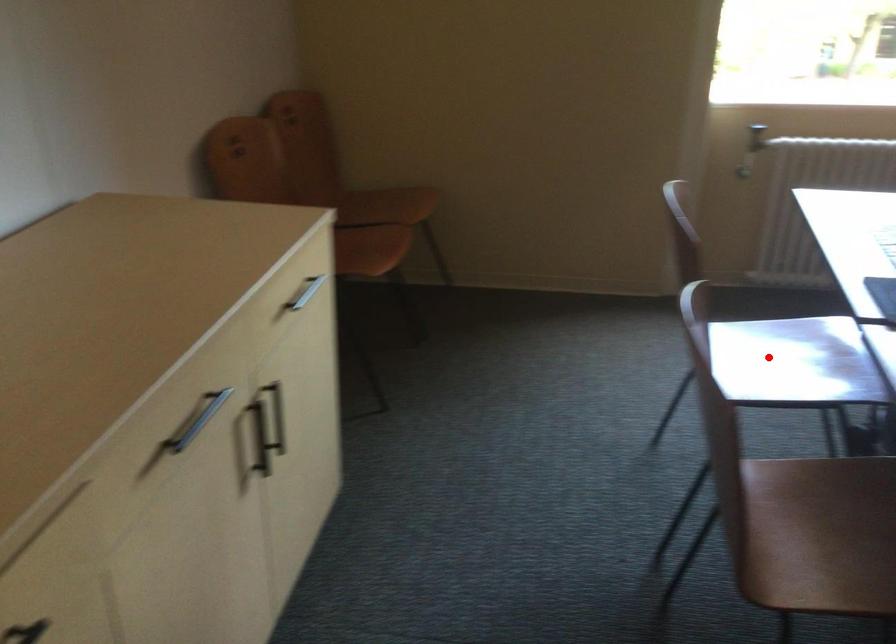
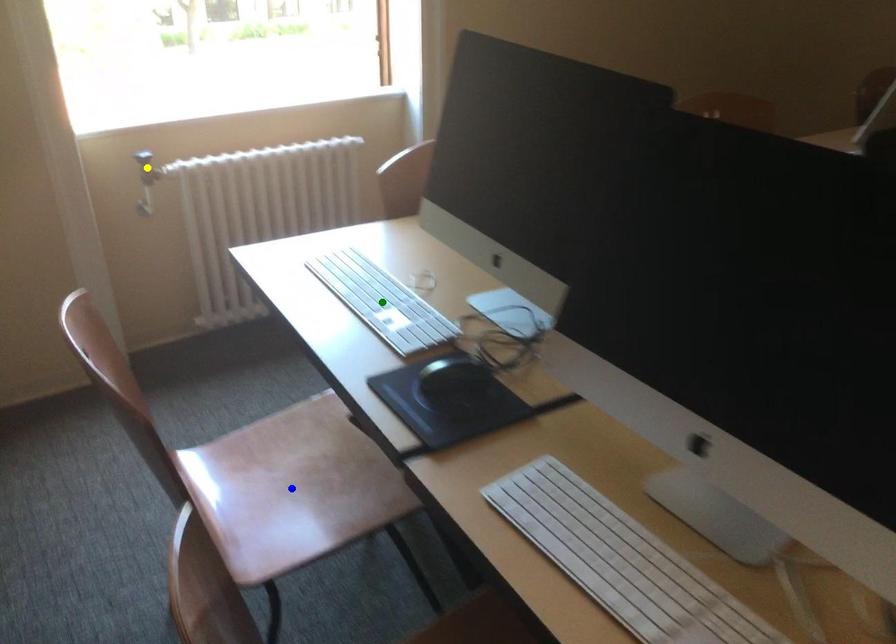
Question: I am providing you with two images of the same scene from different viewpoints. A red point is marked on the first image. You are given multiple points on the second image. Which spot in image 2 lines up with the point in image 1?

Choices:
 (A) green point
 (B) yellow point
 (C) blue point

Answer: (C)